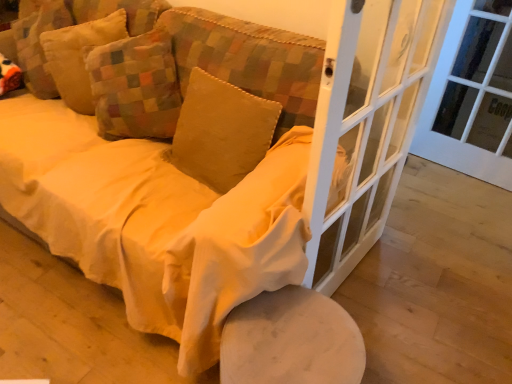
Question: Is velvet yellow pillow at center, acting as the third pillow starting from the left, located outside white glass screen door at center right?

Choices:
 (A) yes
 (B) no

Answer: (A)

Question: Does velvet yellow pillow at center, which is the first pillow in right-to-left order, appear on the left side of white glass screen door at center right?

Choices:
 (A) yes
 (B) no

Answer: (A)

Question: Is velvet yellow pillow at center, acting as the third pillow starting from the left, facing towards white glass screen door at center right?

Choices:
 (A) no
 (B) yes

Answer: (A)

Question: Would you say velvet yellow pillow at center, which is the first pillow in right-to-left order, contains white glass screen door at center right?

Choices:
 (A) yes
 (B) no

Answer: (B)

Question: Is the surface of velvet yellow pillow at center, which is the first pillow in right-to-left order, in direct contact with white glass screen door at center right?

Choices:
 (A) yes
 (B) no

Answer: (B)

Question: Considering the positions of white glass screen door at center right and velvet yellow pillow at center, acting as the third pillow starting from the left, in the image, is white glass screen door at center right wider or thinner than velvet yellow pillow at center, acting as the third pillow starting from the left,?

Choices:
 (A) thin
 (B) wide

Answer: (A)

Question: In terms of height, does white glass screen door at center right look taller or shorter compared to velvet yellow pillow at center, which is the first pillow in right-to-left order?

Choices:
 (A) tall
 (B) short

Answer: (A)

Question: Based on their positions, is white glass screen door at center right located to the left or right of velvet yellow pillow at center, which is the first pillow in right-to-left order?

Choices:
 (A) left
 (B) right

Answer: (B)

Question: From a real-world perspective, is white glass screen door at center right positioned above or below velvet yellow pillow at center, acting as the third pillow starting from the left?

Choices:
 (A) above
 (B) below

Answer: (A)

Question: Visually, is velvet yellow pillow at upper left, which ranks as the second pillow in right-to-left order, positioned to the left or to the right of velvet yellow pillow at upper left, the 3th pillow in the right-to-left sequence?

Choices:
 (A) left
 (B) right

Answer: (B)

Question: In the image, is velvet yellow pillow at upper left, which ranks as the second pillow in right-to-left order, positioned in front of or behind velvet yellow pillow at upper left, the 3th pillow in the right-to-left sequence?

Choices:
 (A) front
 (B) behind

Answer: (A)

Question: From a real-world perspective, is velvet yellow pillow at upper left, which ranks as the second pillow in right-to-left order, positioned above or below velvet yellow pillow at upper left, the 3th pillow in the right-to-left sequence?

Choices:
 (A) above
 (B) below

Answer: (A)

Question: Is velvet yellow pillow at upper left, which ranks as the second pillow in right-to-left order, inside or outside of velvet yellow pillow at upper left, the 3th pillow in the right-to-left sequence?

Choices:
 (A) inside
 (B) outside

Answer: (B)

Question: Is white glass door at right inside or outside of white glass screen door at center right?

Choices:
 (A) outside
 (B) inside

Answer: (A)

Question: Is white glass door at right bigger or smaller than white glass screen door at center right?

Choices:
 (A) small
 (B) big

Answer: (A)